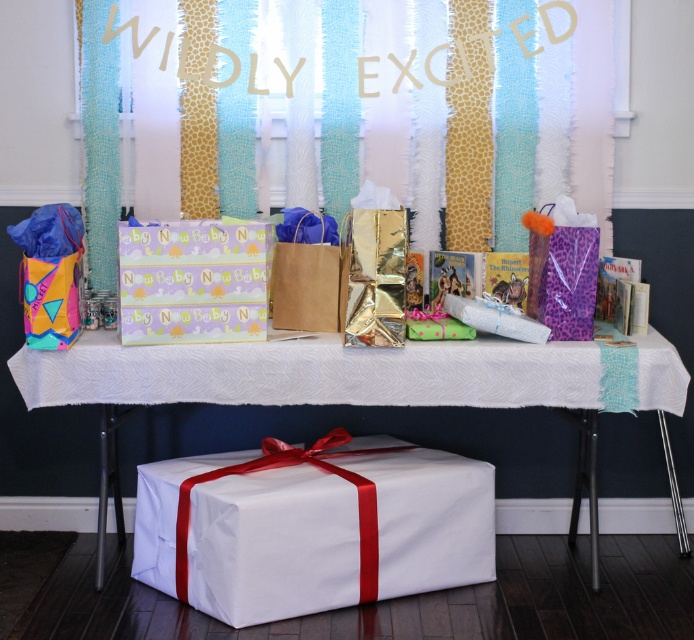
Question: Can you confirm if gold reflective gift bag at center is wider than multicolored fabric gift bag at left?

Choices:
 (A) no
 (B) yes

Answer: (A)

Question: Can you confirm if giraffe print fabric at upper center is positioned above brown paper bag at center?

Choices:
 (A) no
 (B) yes

Answer: (B)

Question: Considering the real-world distances, which object is closest to the white paper gift at center?

Choices:
 (A) giraffe print fabric at upper center
 (B) pastel matte gift bag at center

Answer: (B)

Question: Considering the real-world distances, which object is closest to the giraffe print fabric at upper center?

Choices:
 (A) white paper gift at center
 (B) gold reflective gift bag at center

Answer: (B)

Question: Can you confirm if giraffe print fabric at upper center is bigger than brown paper bag at center?

Choices:
 (A) yes
 (B) no

Answer: (A)

Question: Which object is positioned closest to the gold reflective gift bag at center?

Choices:
 (A) brown paper bag at center
 (B) purple leopard print gift bag at right
 (C) pastel matte gift bag at center
 (D) white paper gift at center

Answer: (A)